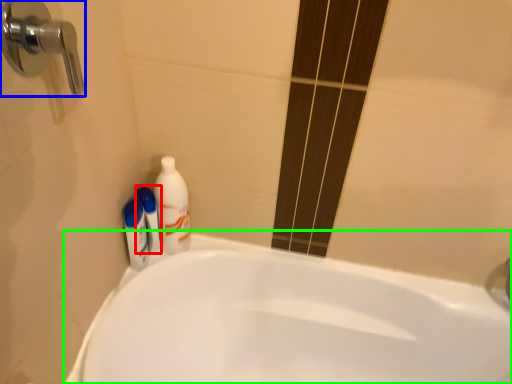
Question: Considering the real-world distances, which object is farthest from mouthwash (highlighted by a red box)? door handle (highlighted by a blue box) or bathtub (highlighted by a green box)?

Choices:
 (A) door handle
 (B) bathtub

Answer: (A)